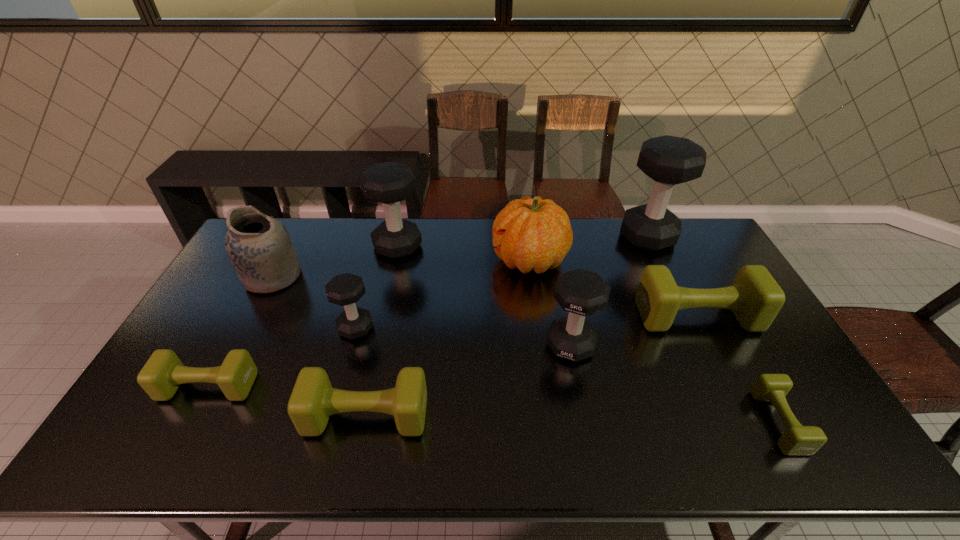
You are a GUI agent. You are given a task and a screenshot of the screen. Output one action in this format:
    pyautogui.click(x=<x>, y=<y>)
    Task: Click on the dumbbell that is at the left edge
    
    Given the screenshot: What is the action you would take?
    pyautogui.click(x=161, y=376)

Where is `object at the far right corner`? object at the far right corner is located at coordinates (668, 160).

Identify the location of object at the near right corner. tap(797, 440).

Image resolution: width=960 pixels, height=540 pixels. Identify the location of free location at the far edge of the desktop. (643, 254).

The width and height of the screenshot is (960, 540). What are the coordinates of `vacant space at the near edge of the desktop` in the screenshot? It's located at (444, 458).

What are the coordinates of `vacant space at the left edge of the desktop` in the screenshot? It's located at (145, 410).

Identify the location of free location at the right edge. (772, 371).

In the image, there is a desktop. At what (x,y) coordinates should I click in order to perform the action: click on vacant area at the far left corner. Please return your answer as a coordinate pair (x, y). Looking at the image, I should click on (286, 221).

Identify the location of vacant space at the far right corner of the desktop. The width and height of the screenshot is (960, 540). (698, 239).

Locate an element on the screen. The height and width of the screenshot is (540, 960). free space between the rightmost gray dumbbell and the pottery is located at coordinates point(460,256).